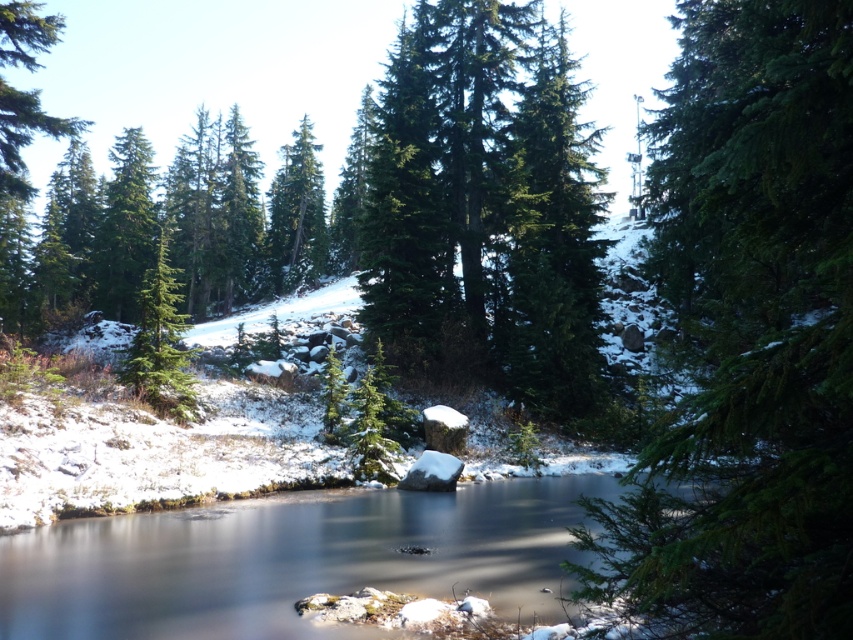
Does translucent ice at center have a smaller size compared to green matte evergreen tree at left?

Indeed, translucent ice at center has a smaller size compared to green matte evergreen tree at left.

Between translucent ice at center and green matte evergreen tree at left, which one has more height?

Standing taller between the two is green matte evergreen tree at left.

Locate an element on the screen. Image resolution: width=853 pixels, height=640 pixels. translucent ice at center is located at coordinates (293, 561).

This screenshot has height=640, width=853. I want to click on translucent ice at center, so click(293, 561).

Who is positioned more to the right, green matte tree at upper center or green matte tree at upper left?

From the viewer's perspective, green matte tree at upper center appears more on the right side.

Can you confirm if green matte tree at upper center is wider than green matte tree at upper left?

Incorrect, green matte tree at upper center's width does not surpass green matte tree at upper left's.

Which is in front, point (534, 282) or point (103, 278)?

Positioned in front is point (534, 282).

I want to click on green matte tree at upper center, so click(x=553, y=241).

Does translucent ice at center have a lesser width compared to green matte tree at upper center?

No, translucent ice at center is not thinner than green matte tree at upper center.

Can you confirm if translucent ice at center is bigger than green matte tree at upper center?

Incorrect, translucent ice at center is not larger than green matte tree at upper center.

Is point (39, 605) closer to camera compared to point (556, 227)?

Yes, it is.

The height and width of the screenshot is (640, 853). Find the location of `translucent ice at center`. translucent ice at center is located at coordinates (293, 561).